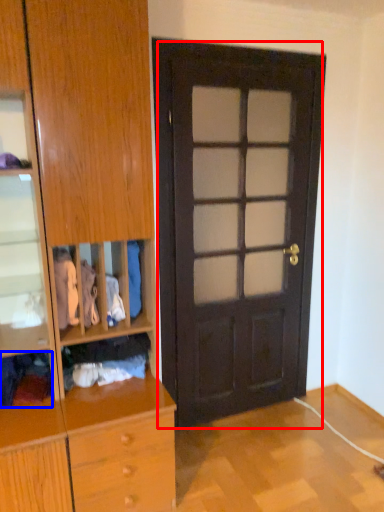
Question: Which object is further to the camera taking this photo, door (highlighted by a red box) or clothing (highlighted by a blue box)?

Choices:
 (A) door
 (B) clothing

Answer: (A)